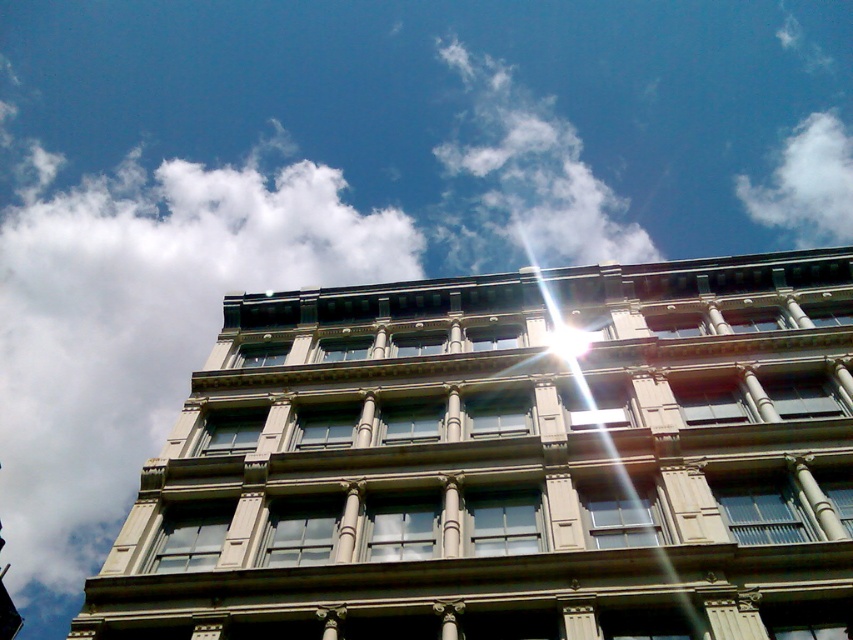
Consider the image. You are standing at the base of the multi story building and want to reach a point that is 1186.79 feet away from you. The point is located at coordinates point (138,400). Can you determine if this point is on the building facade or behind the building?

The point point (138,400) is 1186.79 feet away from the viewer, so it is behind the building since the distance exceeds the building facade.

You are an architect designing a new building and want to ensure the windows are spaced evenly. Looking at the building in the image, which cloud, the white fluffy cloud at upper left or the white fluffy cloud at upper right, would be a better reference for the spacing between windows?

The white fluffy cloud at upper right is a better reference because it is smaller in size compared to the white fluffy cloud at upper left, making it easier to align with the evenly spaced windows.